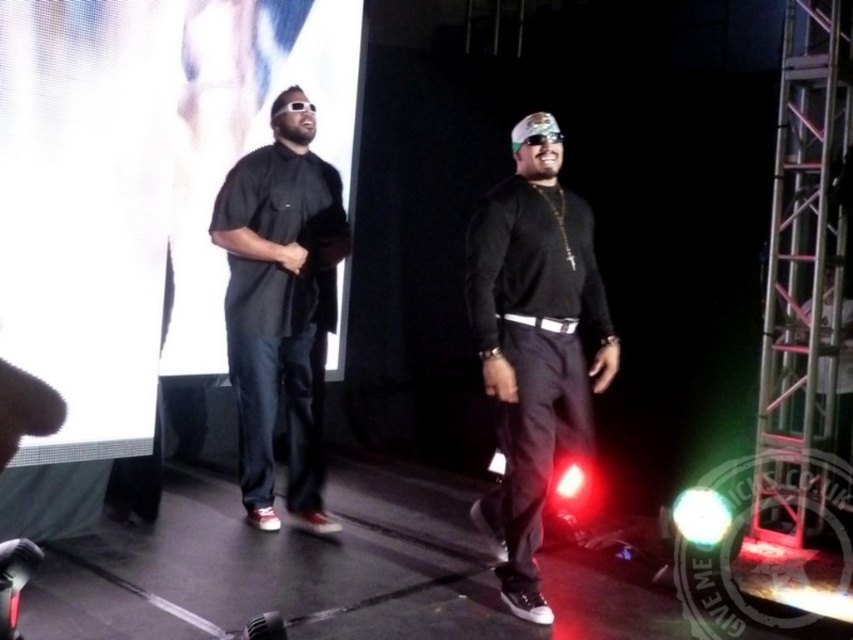
Question: Is black matte shirt at center to the left of matte black shirt at center from the viewer's perspective?

Choices:
 (A) no
 (B) yes

Answer: (A)

Question: Does black matte shirt at center have a lesser width compared to matte black shirt at center?

Choices:
 (A) no
 (B) yes

Answer: (A)

Question: Is black matte shirt at center positioned behind matte black shirt at center?

Choices:
 (A) no
 (B) yes

Answer: (A)

Question: Among these objects, which one is nearest to the camera?

Choices:
 (A) black matte shirt at center
 (B) matte black shirt at center

Answer: (A)